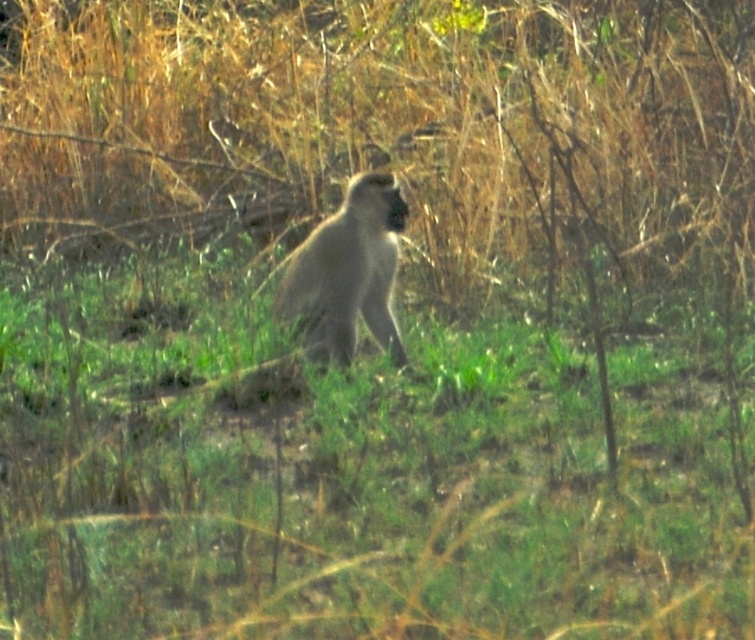
Question: Which object is farther from the camera taking this photo?

Choices:
 (A) green grassy at center
 (B) gray fur monkey at center

Answer: (B)

Question: Which point is farther from the camera taking this photo?

Choices:
 (A) (378, 320)
 (B) (63, 548)

Answer: (A)

Question: Is green grassy at center to the left of gray fur monkey at center from the viewer's perspective?

Choices:
 (A) no
 (B) yes

Answer: (A)

Question: Which point is closer to the camera?

Choices:
 (A) green grassy at center
 (B) gray fur monkey at center

Answer: (A)

Question: Can you confirm if green grassy at center is positioned above gray fur monkey at center?

Choices:
 (A) no
 (B) yes

Answer: (A)

Question: Is green grassy at center behind gray fur monkey at center?

Choices:
 (A) yes
 (B) no

Answer: (B)